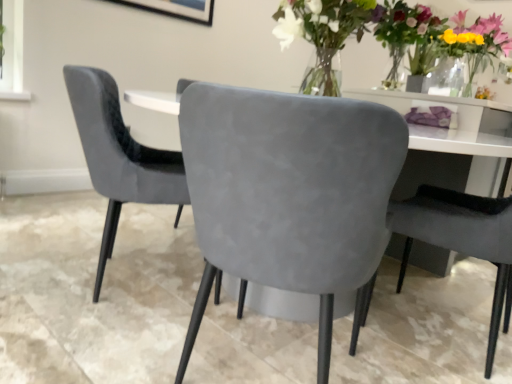
The height and width of the screenshot is (384, 512). Identify the location of free space to the left of velvet grey chair at center, placed as the first chair when sorted from left to right. (47, 254).